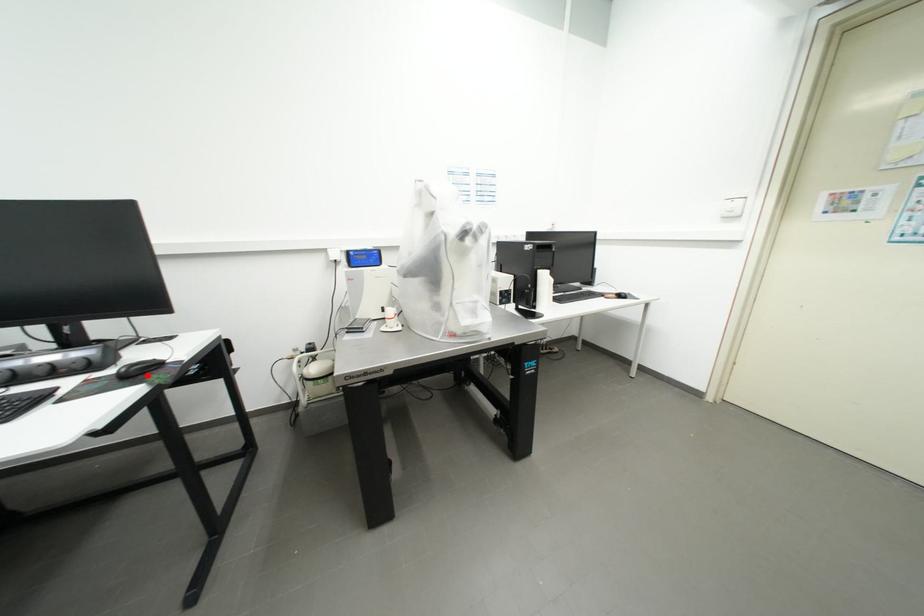
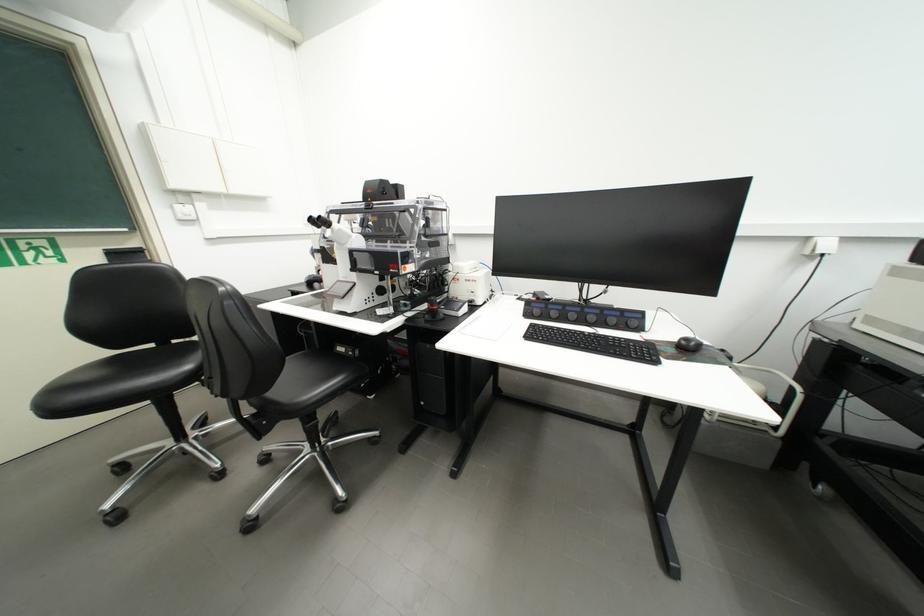
In the second image, find the point that corresponds to the highlighted location in the first image.

(697, 351)